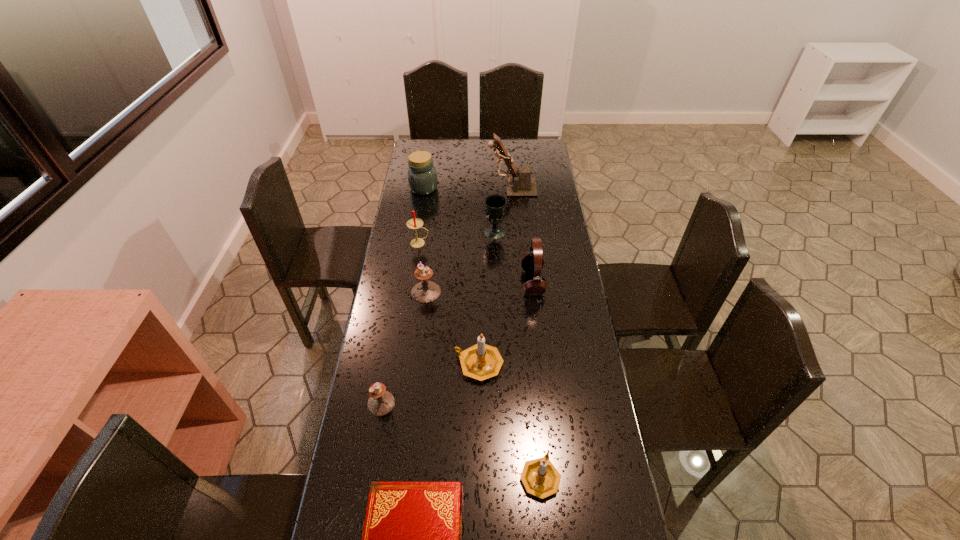
Find the location of a particular element. This screenshot has height=540, width=960. brown figurine is located at coordinates (521, 184).

You are a GUI agent. You are given a task and a screenshot of the screen. Output one action in this format:
    pyautogui.click(x=<x>, y=<y>)
    Task: Click on the figurine
    
    Given the screenshot: What is the action you would take?
    pyautogui.click(x=521, y=184)

Where is `black headset`? black headset is located at coordinates (532, 262).

The width and height of the screenshot is (960, 540). Find the location of `candle`. candle is located at coordinates (415, 223).

The height and width of the screenshot is (540, 960). What are the coordinates of `green jar` in the screenshot? It's located at (422, 177).

Where is `chalice`? The width and height of the screenshot is (960, 540). chalice is located at coordinates (495, 206).

Locate an element on the screen. the bigger purple candle holder is located at coordinates (424, 292).

At what (x,y) coordinates should I click in order to perform the action: click on the farther purple candle holder. Please return your answer as a coordinate pair (x, y). This screenshot has height=540, width=960. Looking at the image, I should click on (424, 292).

Image resolution: width=960 pixels, height=540 pixels. In order to click on the left gold candle holder in this screenshot , I will do coord(481,361).

Where is `the third candle holder from left to right`? This screenshot has width=960, height=540. the third candle holder from left to right is located at coordinates (481, 361).